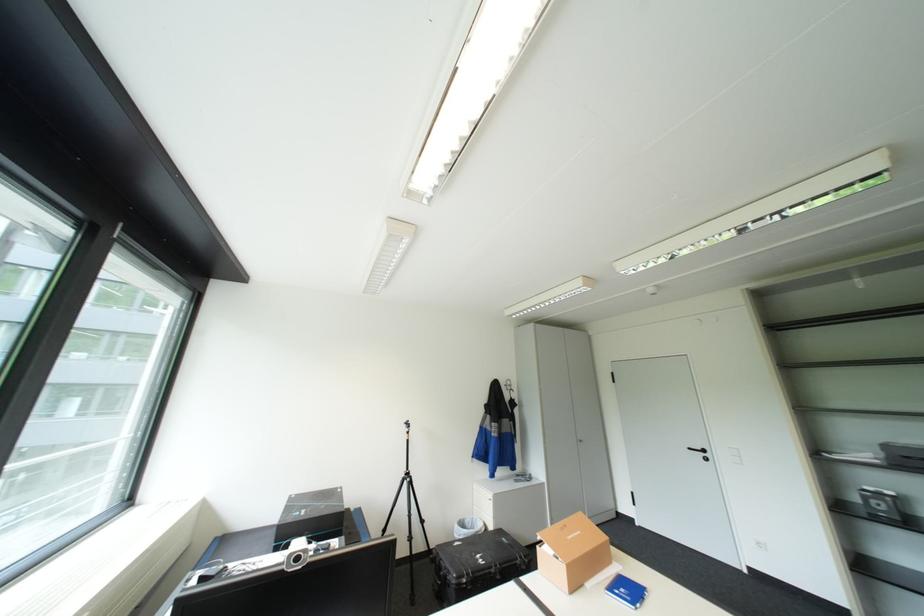
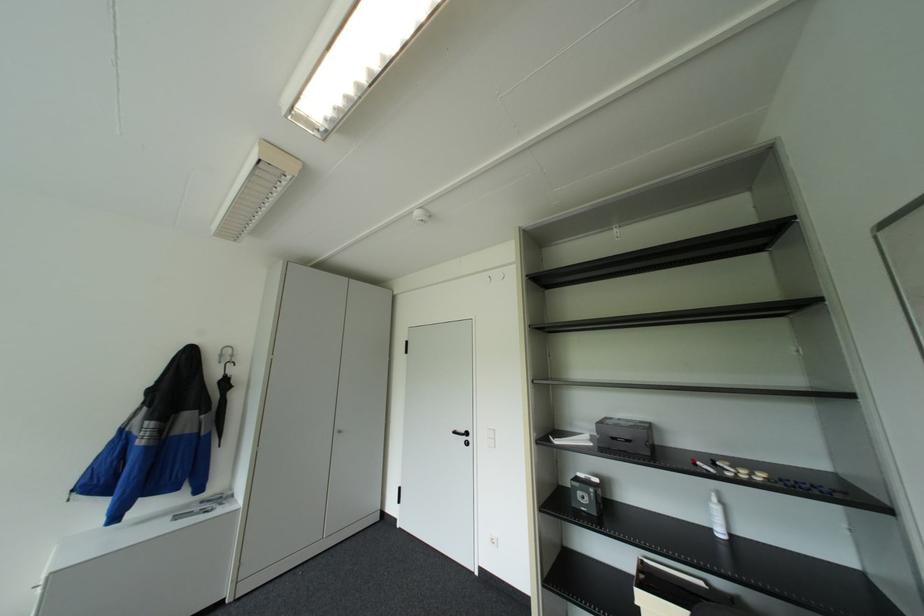
Find the pixel in the second image that matches point (516, 389) in the first image.

(227, 361)